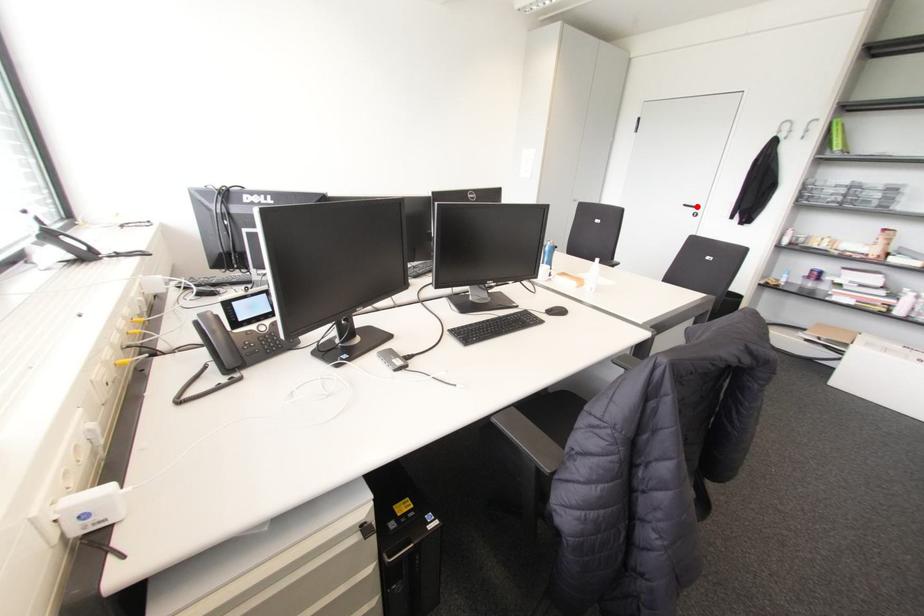
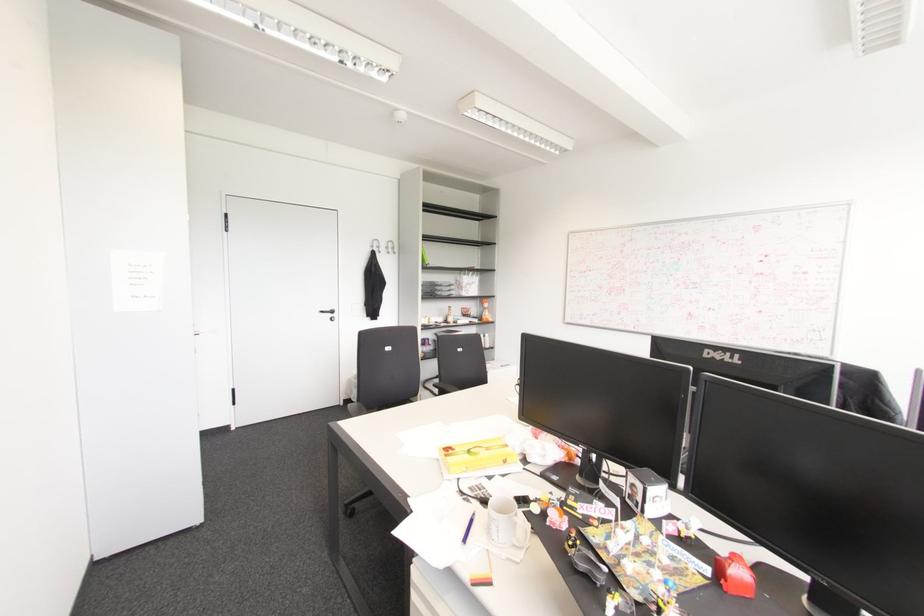
Locate, in the second image, the point that corresponds to the highlighted location in the first image.

(332, 310)